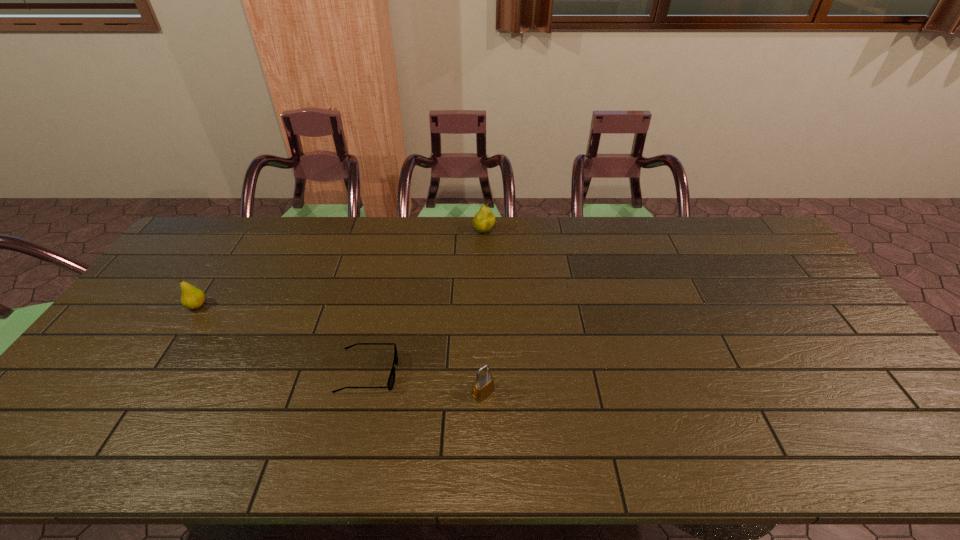
Find the location of a particular element. This screenshot has width=960, height=540. unoccupied position between the nearer pear and the farther pear is located at coordinates (341, 269).

The height and width of the screenshot is (540, 960). Find the location of `free space between the left pear and the farther pear`. free space between the left pear and the farther pear is located at coordinates (341, 269).

I want to click on empty location between the leftmost object and the spectacles, so click(282, 339).

What are the coordinates of `vacant area that lies between the right pear and the padlock` in the screenshot? It's located at (484, 312).

Locate an element on the screen. The height and width of the screenshot is (540, 960). empty space that is in between the leftmost object and the padlock is located at coordinates (340, 349).

You are a GUI agent. You are given a task and a screenshot of the screen. Output one action in this format:
    pyautogui.click(x=<x>, y=<y>)
    Task: Click on the blank region between the shortest object and the farther pear
    
    Given the screenshot: What is the action you would take?
    pyautogui.click(x=426, y=302)

The height and width of the screenshot is (540, 960). In order to click on free space between the padlock and the left pear in this screenshot , I will do `click(340, 349)`.

The width and height of the screenshot is (960, 540). In order to click on vacant area that lies between the padlock and the left pear in this screenshot , I will do `click(340, 349)`.

Where is `object identified as the third closest to the third nearest object`? Image resolution: width=960 pixels, height=540 pixels. object identified as the third closest to the third nearest object is located at coordinates pyautogui.click(x=484, y=219).

Find the location of `object that is the second closest to the third nearest object`. object that is the second closest to the third nearest object is located at coordinates (483, 385).